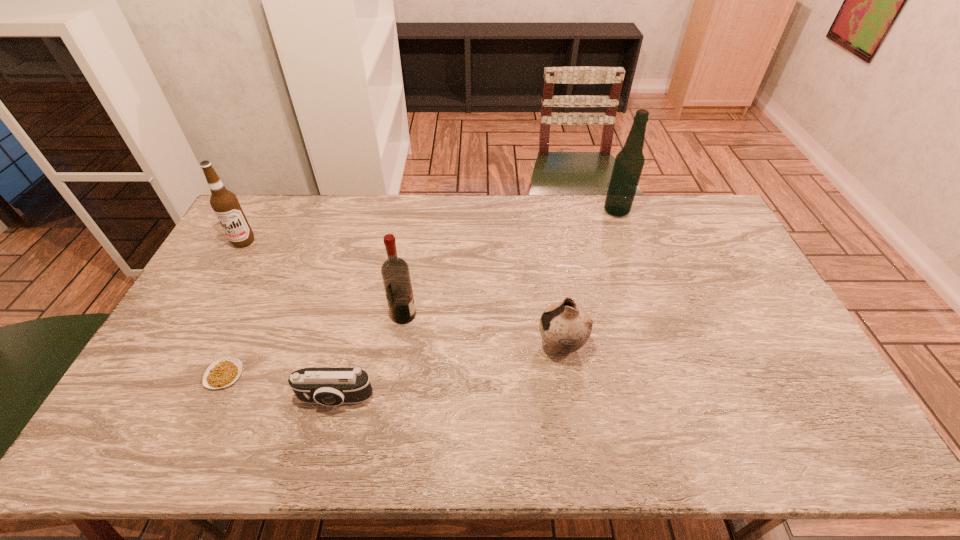
This screenshot has width=960, height=540. In order to click on object that stands as the closest to the shortest object in this screenshot , I will do `click(327, 386)`.

Locate an element on the screen. The height and width of the screenshot is (540, 960). alcohol that is the nearest to the second shortest object is located at coordinates (395, 273).

The image size is (960, 540). In order to click on alcohol that is the second nearest to the second shortest object in this screenshot , I will do `click(225, 204)`.

Locate an element on the screen. This screenshot has height=540, width=960. free space that satisfies the following two spatial constraints: 1. on the label of the leftmost alcohol; 2. on the left side of the legume is located at coordinates (169, 375).

This screenshot has width=960, height=540. What are the coordinates of `free spot that satisfies the following two spatial constraints: 1. on the back side of the farthest alcohol; 2. on the left side of the second object from left to right` in the screenshot? It's located at (300, 211).

Locate an element on the screen. vacant space that satisfies the following two spatial constraints: 1. on the label of the shortest object; 2. on the left side of the second nearest alcohol is located at coordinates (169, 375).

In order to click on free location that satisfies the following two spatial constraints: 1. on the front and back of the second alcohol from left to right; 2. on the front side of the shortest object in this screenshot , I will do `click(395, 375)`.

At what (x,y) coordinates should I click in order to perform the action: click on free space that satisfies the following two spatial constraints: 1. on the label of the second object from left to right; 2. on the left side of the fifth nearest object. Please return your answer as a coordinate pair (x, y). Looking at the image, I should click on (169, 375).

Where is `free space that satisfies the following two spatial constraints: 1. on the label of the legume; 2. on the left side of the leftmost object`? The image size is (960, 540). free space that satisfies the following two spatial constraints: 1. on the label of the legume; 2. on the left side of the leftmost object is located at coordinates (169, 375).